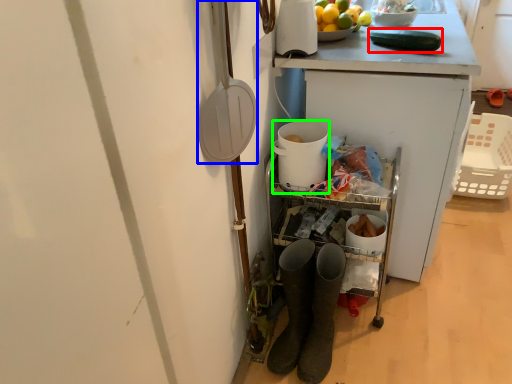
Question: Estimate the real-world distances between objects in this image. Which object is closer to cucumber (highlighted by a red box), shovel (highlighted by a blue box) or appliance (highlighted by a green box)?

Choices:
 (A) shovel
 (B) appliance

Answer: (B)